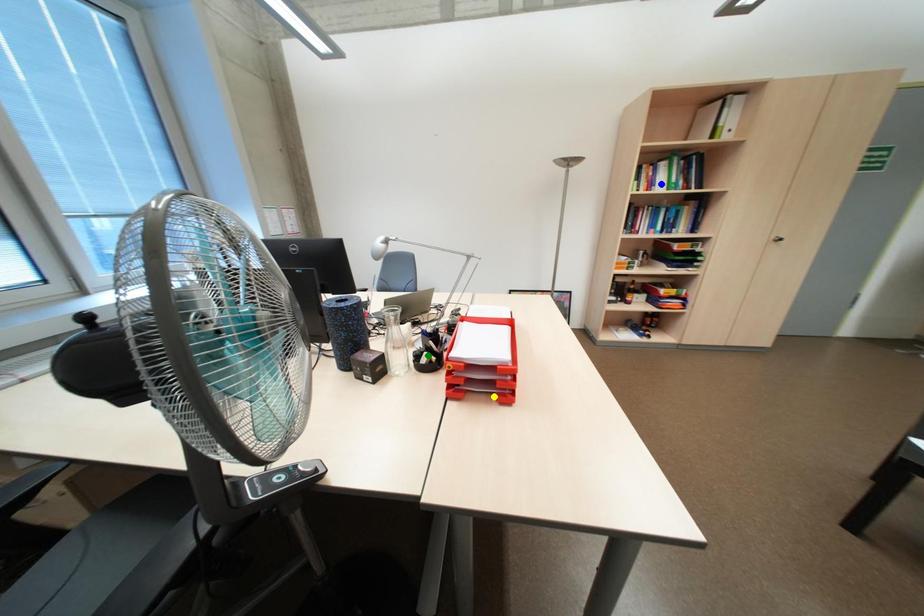
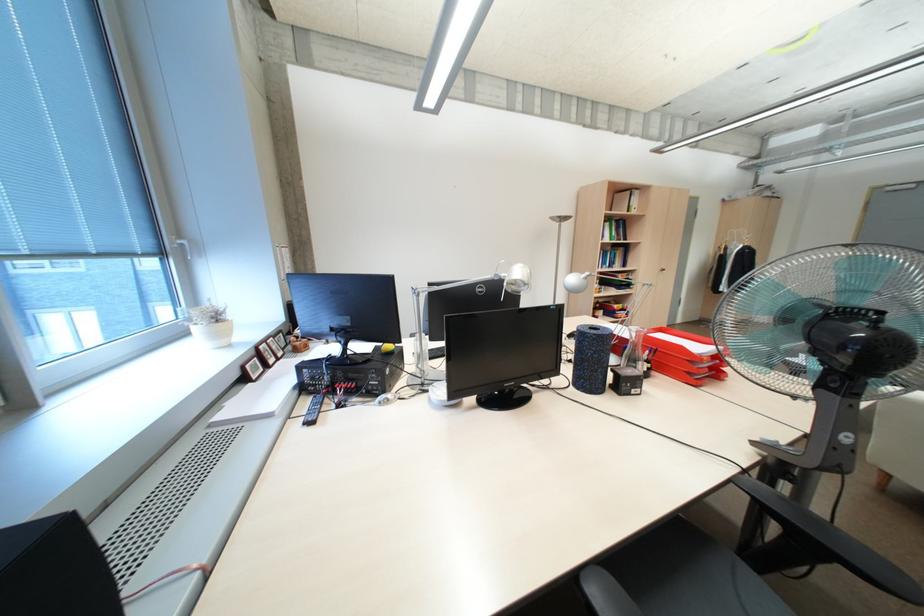
I am providing you with two images of the same scene from different viewpoints. Three points are marked in image1. Which point corresponds to a part or object that is occluded in image2?In image1, three points are marked. Which of them correspond to a part or object that is occluded in image2?Among the three points shown in image1, which one corresponds to a part or object that is no longer visible due to occlusion in image2?

green point